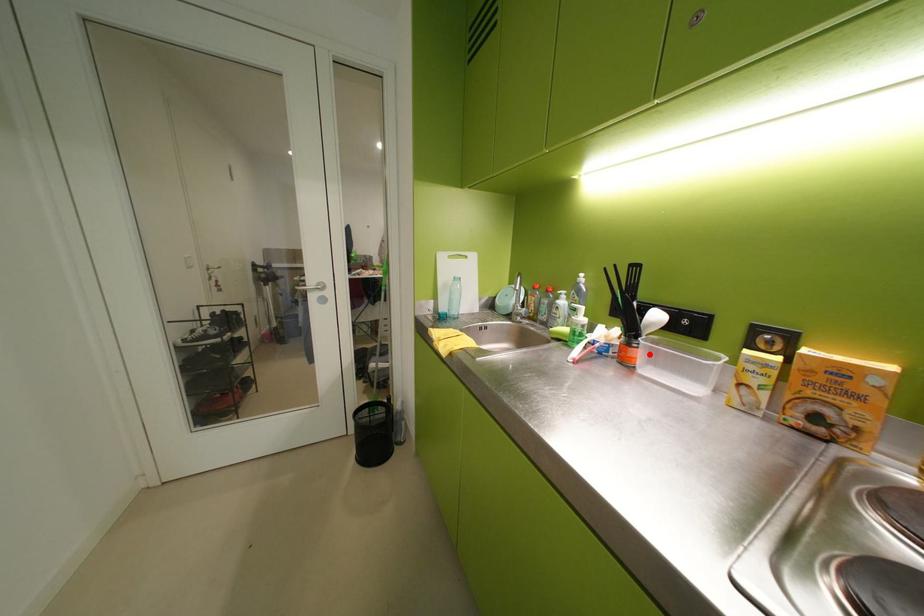
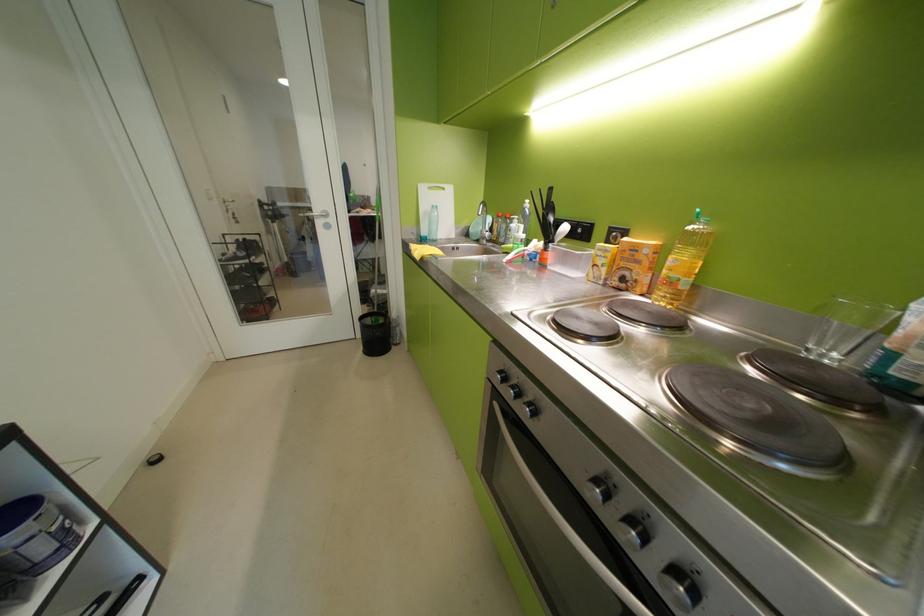
In the second image, find the point that corresponds to the highlighted location in the first image.

(561, 256)